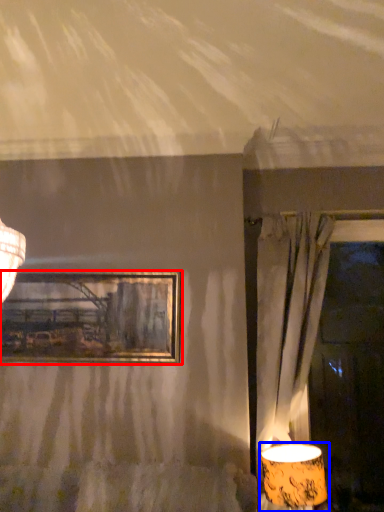
Question: Which point is further to the camera, picture frame (highlighted by a red box) or lamp (highlighted by a blue box)?

Choices:
 (A) picture frame
 (B) lamp

Answer: (A)